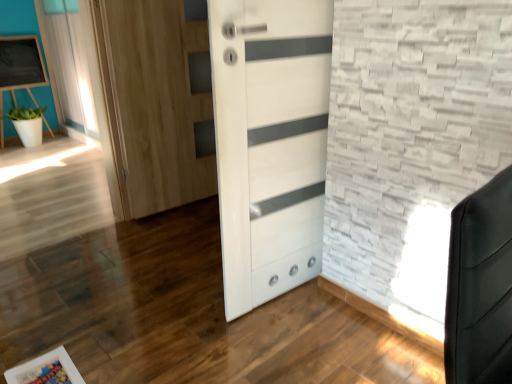
I want to click on white glossy door at center, so click(270, 142).

This screenshot has width=512, height=384. What do you see at coordinates (20, 69) in the screenshot? I see `matte black chalkboard at upper left` at bounding box center [20, 69].

Where is `white sheer curtain at upper left`? Image resolution: width=512 pixels, height=384 pixels. white sheer curtain at upper left is located at coordinates (70, 64).

Considering the positions of objects white glossy door at center and wooden picture frame at lower left in the image provided, who is in front, white glossy door at center or wooden picture frame at lower left?

white glossy door at center.

Between point (273, 109) and point (62, 372), which one is positioned behind?

Point (273, 109)

Where is `picture frame located underneath the white glossy door at center (from a real-world perspective)`? picture frame located underneath the white glossy door at center (from a real-world perspective) is located at coordinates (46, 370).

How many degrees apart are the facing directions of white glossy door at center and wooden picture frame at lower left?

The facing directions of white glossy door at center and wooden picture frame at lower left are 179 degrees apart.

Who is taller, white glossy door at center or matte black chalkboard at upper left?

Standing taller between the two is white glossy door at center.

From a real-world perspective, does white glossy door at center sit lower than matte black chalkboard at upper left?

Actually, white glossy door at center is physically above matte black chalkboard at upper left in the real world.

Which point is more distant from viewer, [298,166] or [37,46]?

The point [37,46] is farther.

Is white glossy door at center with matte black chalkboard at upper left?

No.

Is white matte pot at left shorter than wooden picture frame at lower left?

No.

From a real-world perspective, between white matte pot at left and wooden picture frame at lower left, who is vertically higher?

white matte pot at left is physically above.

From the image's perspective, between white matte pot at left and wooden picture frame at lower left, who is located below?

From the image's view, wooden picture frame at lower left is below.

Is white matte pot at left beside wooden picture frame at lower left?

No, white matte pot at left is not touching wooden picture frame at lower left.

Between white glossy door at center and white sheer curtain at upper left, which one has less height?

white glossy door at center.

Would you say white sheer curtain at upper left is part of white glossy door at center's contents?

That's incorrect, white sheer curtain at upper left is not inside white glossy door at center.

How different are the orientations of white glossy door at center and white sheer curtain at upper left in degrees?

94.5 degrees.

From a real-world perspective, is white glossy door at center positioned over white sheer curtain at upper left based on gravity?

Incorrect, from a real-world perspective, white glossy door at center is lower than white sheer curtain at upper left.

From the image's perspective, is matte black chalkboard at upper left positioned above or below white sheer curtain at upper left?

From the image's perspective, matte black chalkboard at upper left appears below white sheer curtain at upper left.

This screenshot has height=384, width=512. Identify the location of bulletin board below the white sheer curtain at upper left (from the image's perspective). (20, 69).

From a real-world perspective, is matte black chalkboard at upper left on white sheer curtain at upper left?

No, from a real-world perspective, matte black chalkboard at upper left is not over white sheer curtain at upper left

Based on their sizes in the image, would you say white sheer curtain at upper left is bigger or smaller than wooden picture frame at lower left?

Clearly, white sheer curtain at upper left is larger in size than wooden picture frame at lower left.

Image resolution: width=512 pixels, height=384 pixels. I want to click on curtain located above the wooden picture frame at lower left (from a real-world perspective), so click(x=70, y=64).

Considering the sizes of objects white sheer curtain at upper left and wooden picture frame at lower left in the image provided, who is shorter, white sheer curtain at upper left or wooden picture frame at lower left?

wooden picture frame at lower left is shorter.

Is white sheer curtain at upper left wider or thinner than wooden picture frame at lower left?

Considering their sizes, white sheer curtain at upper left looks slimmer than wooden picture frame at lower left.

Is wooden picture frame at lower left aimed at white matte pot at left?

No, wooden picture frame at lower left does not turn towards white matte pot at left.

Does wooden picture frame at lower left contain white matte pot at left?

No, white matte pot at left is not a part of wooden picture frame at lower left.

Considering the positions of point (64, 373) and point (10, 115), is point (64, 373) closer or farther from the camera than point (10, 115)?

Clearly, point (64, 373) is closer to the camera than point (10, 115).

From the picture: Between wooden picture frame at lower left and white matte pot at left, which one has less height?

wooden picture frame at lower left is shorter.

Locate an element on the screen. Image resolution: width=512 pixels, height=384 pixels. door in front of the wooden picture frame at lower left is located at coordinates (270, 142).

In order to click on door that is below the matte black chalkboard at upper left (from the image's perspective) in this screenshot , I will do `click(270, 142)`.

Looking at the image, which one is located further to matte black chalkboard at upper left, white glossy door at center or white sheer curtain at upper left?

white glossy door at center is positioned further to the anchor matte black chalkboard at upper left.

Which object lies further to the anchor point white sheer curtain at upper left, wooden picture frame at lower left or matte black chalkboard at upper left?

The object further to white sheer curtain at upper left is wooden picture frame at lower left.

Which object lies further to the anchor point white matte pot at left, white glossy door at center or matte black chalkboard at upper left?

The object further to white matte pot at left is white glossy door at center.

When comparing their distances from wooden picture frame at lower left, does matte black chalkboard at upper left or white matte pot at left seem closer?

white matte pot at left lies closer to wooden picture frame at lower left than the other object.

Considering their positions, is white matte pot at left positioned closer to white glossy door at center than white sheer curtain at upper left?

The object closer to white glossy door at center is white sheer curtain at upper left.

Which object lies further to the anchor point matte black chalkboard at upper left, white matte pot at left or wooden picture frame at lower left?

Based on the image, wooden picture frame at lower left appears to be further to matte black chalkboard at upper left.

Based on their spatial positions, is matte black chalkboard at upper left or wooden picture frame at lower left further from white matte pot at left?

Among the two, wooden picture frame at lower left is located further to white matte pot at left.

Based on their spatial positions, is wooden picture frame at lower left or white sheer curtain at upper left closer to white glossy door at center?

Among the two, wooden picture frame at lower left is located nearer to white glossy door at center.

Where is `curtain located between white glossy door at center and white matte pot at left in the depth direction`? curtain located between white glossy door at center and white matte pot at left in the depth direction is located at coordinates (70, 64).

Where is `picture frame between white glossy door at center and matte black chalkboard at upper left along the z-axis`? The width and height of the screenshot is (512, 384). picture frame between white glossy door at center and matte black chalkboard at upper left along the z-axis is located at coordinates (46, 370).

Locate an element on the screen. The image size is (512, 384). curtain between wooden picture frame at lower left and matte black chalkboard at upper left from front to back is located at coordinates (70, 64).

The width and height of the screenshot is (512, 384). Find the location of `curtain positioned between white glossy door at center and matte black chalkboard at upper left from near to far`. curtain positioned between white glossy door at center and matte black chalkboard at upper left from near to far is located at coordinates (70, 64).